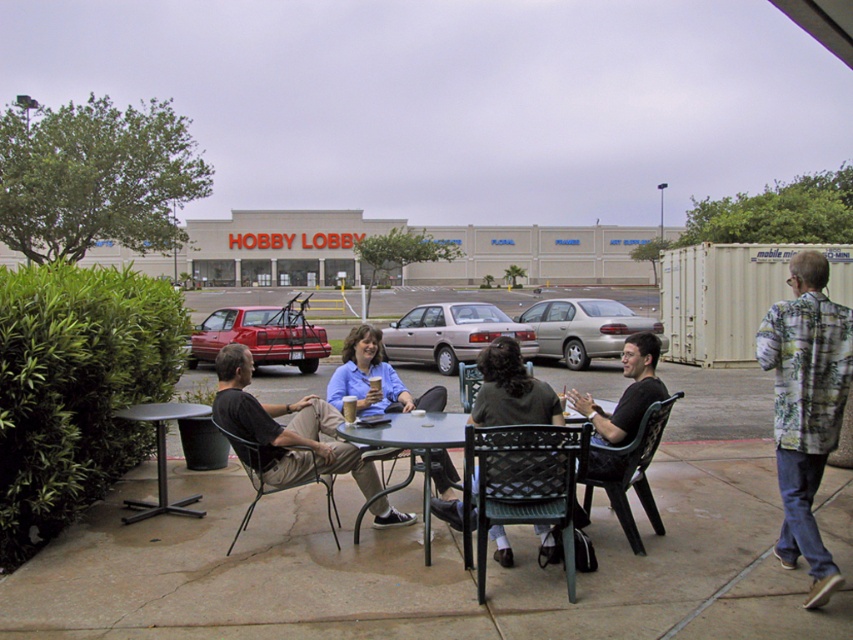
You are standing at the entrance of the Hobby Lobby store and see a gold metallic sedan at center and a metallic gray table at center. Which object is positioned higher from the ground?

The gold metallic sedan at center is located above the metallic gray table at center, so it is positioned higher from the ground.

You are planning to place a large potted plant between the green woven metal chair at center and the metallic black table at lower left. Considering their sizes, will the plant fit comfortably without overcrowding the space?

The green woven metal chair at center is smaller than the metallic black table at lower left, so there might be enough space to place a large potted plant between them without overcrowding the area.

Please look at the image. There is a point at coordinates (584, 328). What object is located at that point?

The gold metallic sedan at center is located at point (584, 328).